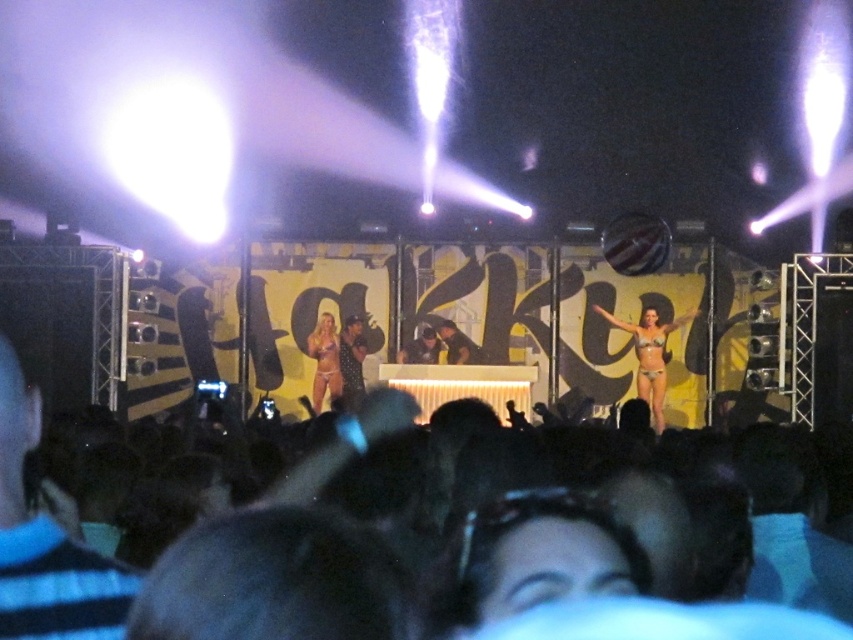
Question: Considering the relative positions of black hair at lower center and matte purple bikini at center in the image provided, where is black hair at lower center located with respect to matte purple bikini at center?

Choices:
 (A) right
 (B) left

Answer: (A)

Question: Is black hair at lower center positioned at the back of matte purple bikini at center?

Choices:
 (A) no
 (B) yes

Answer: (A)

Question: Can you confirm if black hair at lower center is positioned to the left of matte black sunglasses at center?

Choices:
 (A) no
 (B) yes

Answer: (B)

Question: Which object appears closest to the camera in this image?

Choices:
 (A) matte bikini at center
 (B) matte black sunglasses at center

Answer: (B)

Question: Which point appears farthest from the camera in this image?

Choices:
 (A) (279, 536)
 (B) (521, 563)
 (C) (329, 374)

Answer: (C)

Question: Which of the following is the closest to the observer?

Choices:
 (A) (631, 326)
 (B) (519, 568)

Answer: (B)